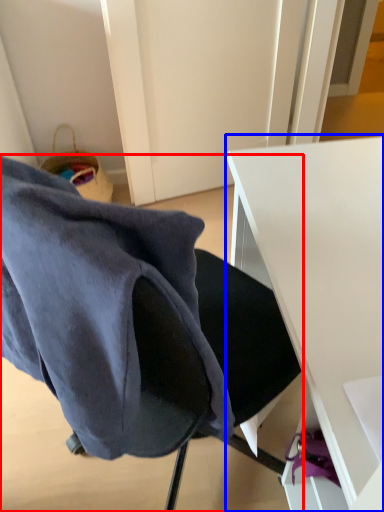
Question: Which point is further to the camera, chair (highlighted by a red box) or desk (highlighted by a blue box)?

Choices:
 (A) chair
 (B) desk

Answer: (B)